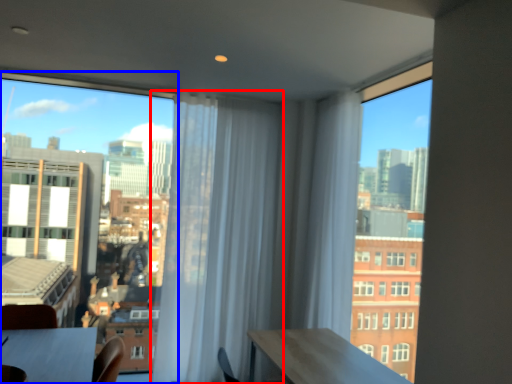
Question: Which point is closer to the camera, curtain (highlighted by a red box) or window (highlighted by a blue box)?

Choices:
 (A) curtain
 (B) window

Answer: (B)